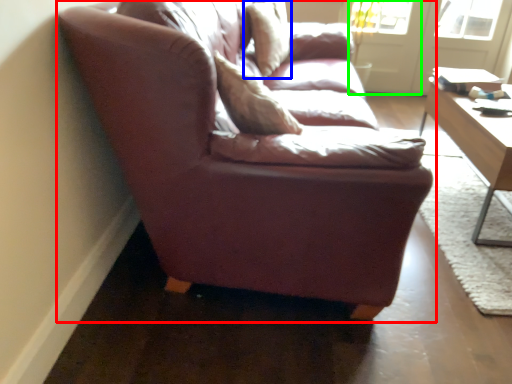
Question: Based on their relative distances, which object is nearer to studio couch (highlighted by a red box)? Choose from pillow (highlighted by a blue box) and screen door (highlighted by a green box).

Choices:
 (A) pillow
 (B) screen door

Answer: (A)